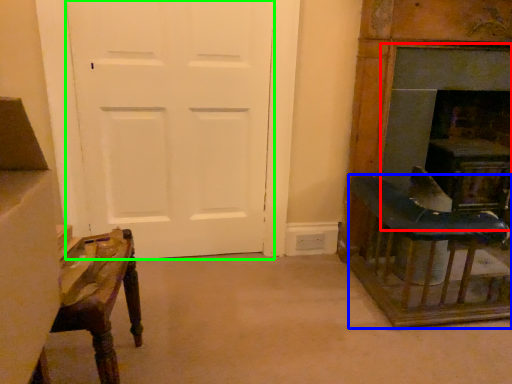
Question: Which object is the closest to the fireplace (highlighted by a red box)? Choose among these: table (highlighted by a blue box) or screen door (highlighted by a green box).

Choices:
 (A) table
 (B) screen door

Answer: (A)